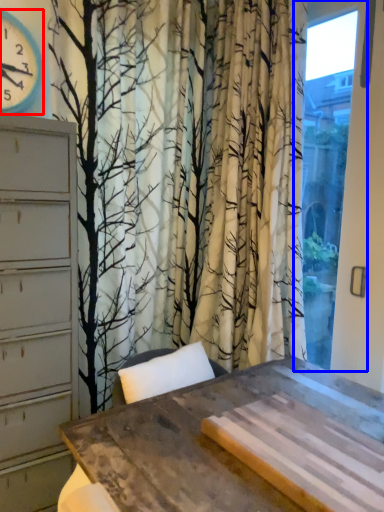
Question: Which of the following is the closest to the observer, clock (highlighted by a red box) or window (highlighted by a blue box)?

Choices:
 (A) clock
 (B) window

Answer: (B)